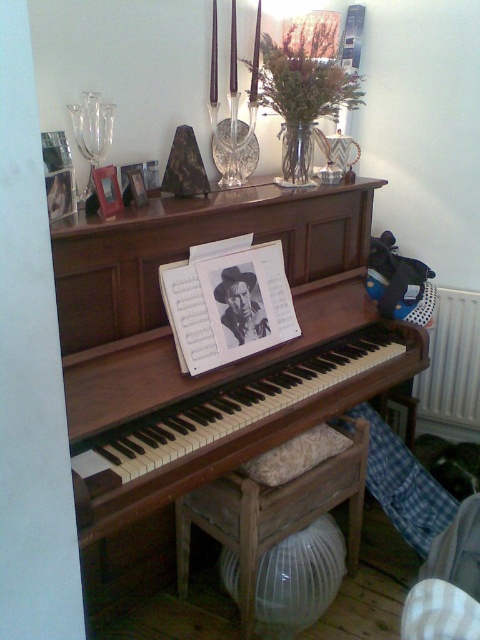
Who is more forward, (408, 330) or (476, 378)?

Point (408, 330) is in front.

Is point (333, 397) positioned before point (424, 397)?

Yes, it is in front of point (424, 397).

Where is `wooden piano at center`? This screenshot has width=480, height=640. wooden piano at center is located at coordinates (186, 257).

Who is shorter, wooden piano at center or matte wooden picture frame at upper center?

Standing shorter between the two is matte wooden picture frame at upper center.

Between wooden piano at center and matte wooden picture frame at upper center, which one is positioned higher?

matte wooden picture frame at upper center is higher up.

What do you see at coordinates (186, 257) in the screenshot?
I see `wooden piano at center` at bounding box center [186, 257].

The width and height of the screenshot is (480, 640). I want to click on wooden piano at center, so click(x=186, y=257).

Find the location of a particular element. This screenshot has height=640, width=480. wooden at lower center is located at coordinates (271, 515).

Which is in front, point (252, 561) or point (49, 184)?

Point (49, 184)

Find the location of a particular element. This screenshot has width=480, height=640. wooden at lower center is located at coordinates (271, 515).